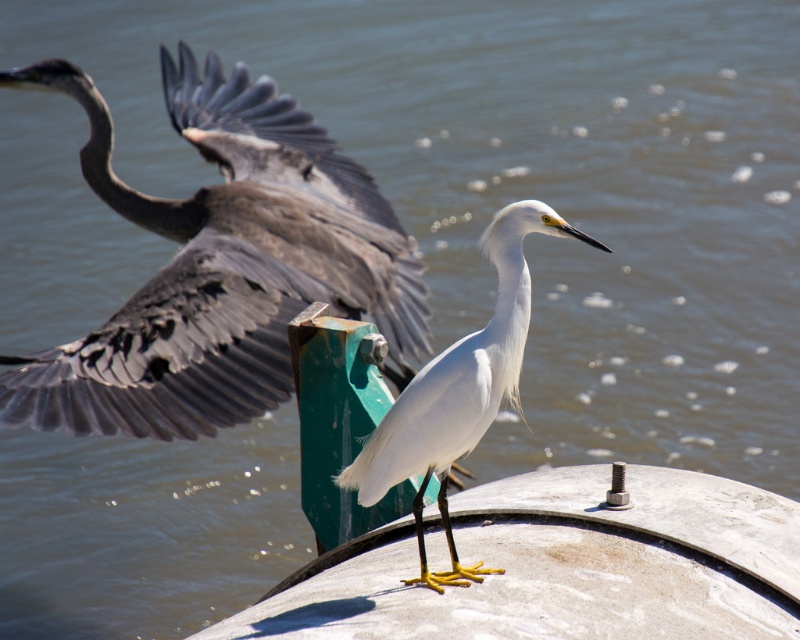
You are a birdwatcher trying to determine the relative sizes of the birds in the image. Based on the scene, which bird is wider, the gray matte heron at left or the white matte bird at center?

The gray matte heron at left might be wider than the white matte bird at center according to the description.

You are observing two birds in a serene scene. The gray matte heron at left and the white matte bird at center are both present. Which bird is located to the right of the other?

The white matte bird at center is located to the right of the gray matte heron at left because the gray matte heron at left is positioned on the left side of white matte bird at center.

From the picture: You are a birdwatcher trying to track the positions of the birds in the image. The white bird is perched on a concrete surface in the foreground. Where is the gray matte heron at left in relation to the white bird?

The gray matte heron at left is located at point [220,264] relative to the white bird in the foreground.